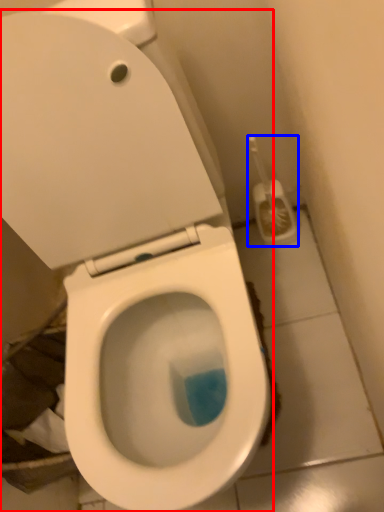
Question: Which of the following is the closest to the observer, toilet (highlighted by a red box) or brush (highlighted by a blue box)?

Choices:
 (A) toilet
 (B) brush

Answer: (A)